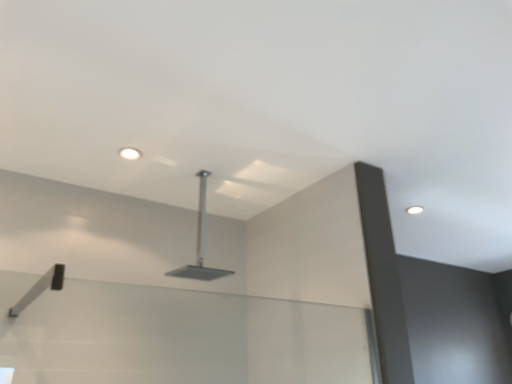
Question: Does white glossy droplight at upper right, placed as the 2th droplight when sorted from left to right, contain matte white droplight at upper center, acting as the 2th droplight starting from the back?

Choices:
 (A) no
 (B) yes

Answer: (A)

Question: Is white glossy droplight at upper right, acting as the 1th droplight starting from the right, smaller than matte white droplight at upper center, which ranks as the 1th droplight in front-to-back order?

Choices:
 (A) no
 (B) yes

Answer: (A)

Question: Can you confirm if white glossy droplight at upper right, acting as the 1th droplight starting from the right, is bigger than matte white droplight at upper center, which ranks as the 2th droplight in bottom-to-top order?

Choices:
 (A) yes
 (B) no

Answer: (A)

Question: Is white glossy droplight at upper right, placed as the 2th droplight when sorted from left to right, to the left of matte white droplight at upper center, the 1th droplight viewed from the top, from the viewer's perspective?

Choices:
 (A) no
 (B) yes

Answer: (A)

Question: From a real-world perspective, is white glossy droplight at upper right, positioned as the second droplight in top-to-bottom order, located higher than matte white droplight at upper center, placed as the 1th droplight when sorted from left to right?

Choices:
 (A) no
 (B) yes

Answer: (B)

Question: Would you say matte white droplight at upper center, acting as the 2th droplight starting from the back, is to the left or to the right of white glossy droplight at upper right, which appears as the 2th droplight when viewed from the front, in the picture?

Choices:
 (A) right
 (B) left

Answer: (B)

Question: Which is correct: matte white droplight at upper center, the second droplight viewed from the right, is inside white glossy droplight at upper right, positioned as the second droplight in top-to-bottom order, or outside of it?

Choices:
 (A) inside
 (B) outside

Answer: (B)

Question: From a real-world perspective, is matte white droplight at upper center, acting as the 2th droplight starting from the back, above or below white glossy droplight at upper right, placed as the 2th droplight when sorted from left to right?

Choices:
 (A) above
 (B) below

Answer: (B)

Question: From the image's perspective, is matte white droplight at upper center, which ranks as the 1th droplight in front-to-back order, above or below white glossy droplight at upper right, which ranks as the 1th droplight in back-to-front order?

Choices:
 (A) above
 (B) below

Answer: (A)

Question: In terms of height, does white glossy droplight at upper right, acting as the 1th droplight starting from the right, look taller or shorter compared to satin silver showerhead at center?

Choices:
 (A) short
 (B) tall

Answer: (A)

Question: Is white glossy droplight at upper right, positioned as the second droplight in top-to-bottom order, inside the boundaries of satin silver showerhead at center, or outside?

Choices:
 (A) outside
 (B) inside

Answer: (A)

Question: In the image, is white glossy droplight at upper right, positioned as the second droplight in top-to-bottom order, on the left side or the right side of satin silver showerhead at center?

Choices:
 (A) left
 (B) right

Answer: (B)

Question: Is white glossy droplight at upper right, which is the 1th droplight from bottom to top, bigger or smaller than satin silver showerhead at center?

Choices:
 (A) small
 (B) big

Answer: (A)

Question: From a real-world perspective, is satin silver showerhead at center positioned above or below white glossy droplight at upper right, which ranks as the 1th droplight in back-to-front order?

Choices:
 (A) below
 (B) above

Answer: (A)

Question: From the image's perspective, is satin silver showerhead at center positioned above or below white glossy droplight at upper right, acting as the 1th droplight starting from the right?

Choices:
 (A) above
 (B) below

Answer: (B)